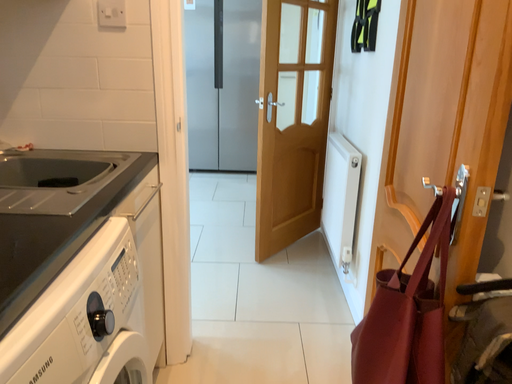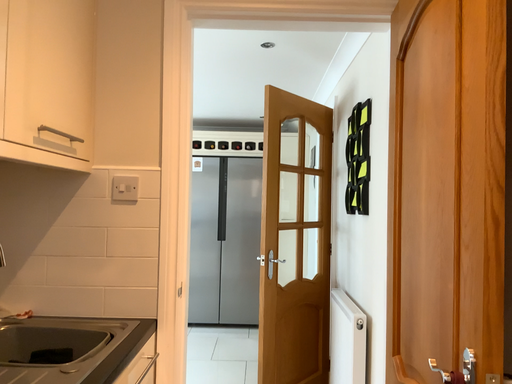
Question: How did the camera likely rotate when shooting the video?

Choices:
 (A) rotated upward
 (B) rotated downward

Answer: (A)